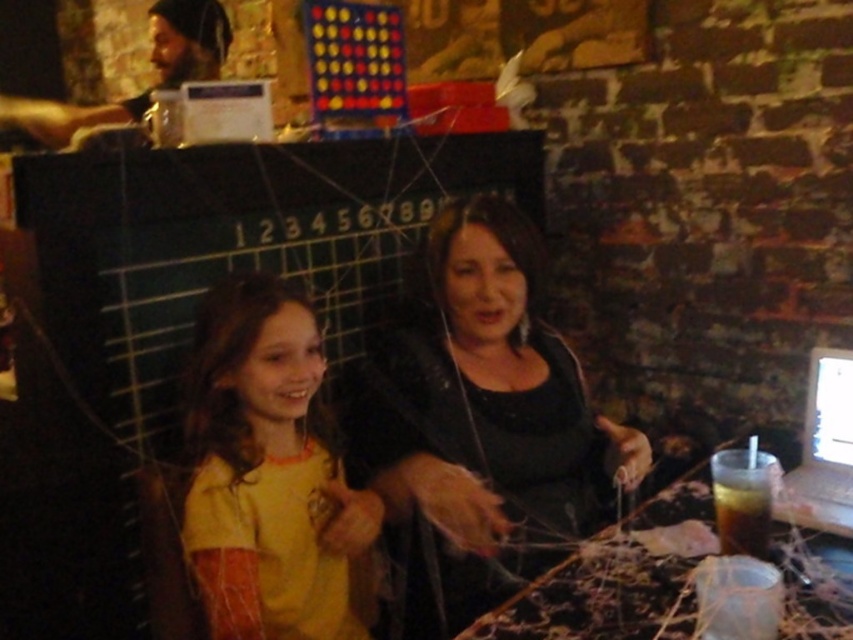
You are a photographer trying to capture a photo of both the black matte shirt at center and the yellow matte shirt at center. Since you want both shirts to appear clearly in the photo, which shirt should you focus on to ensure the taller one is in focus?

The black matte shirt at center is much taller than the yellow matte shirt at center, so you should focus on the black matte shirt at center to ensure it is in focus, which will also keep the yellow matte shirt at center sharp.

You are a person with a 6 inch long ruler. You want to measure the distance between the translucent plastic table at center and the dark brown liquid at lower right. Can you reach both objects with your ruler without moving it?

The distance between the translucent plastic table at center and the dark brown liquid at lower right is 6.32 inches. Since your ruler is 6 inches long, it is slightly shorter than the required distance. You cannot fully measure the distance with the ruler as it is 0.32 inches too short.